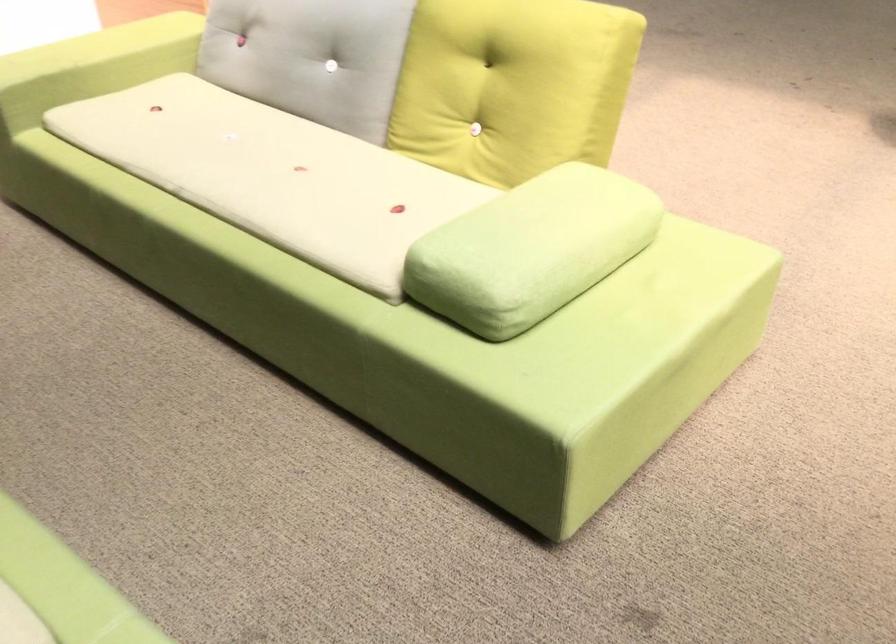
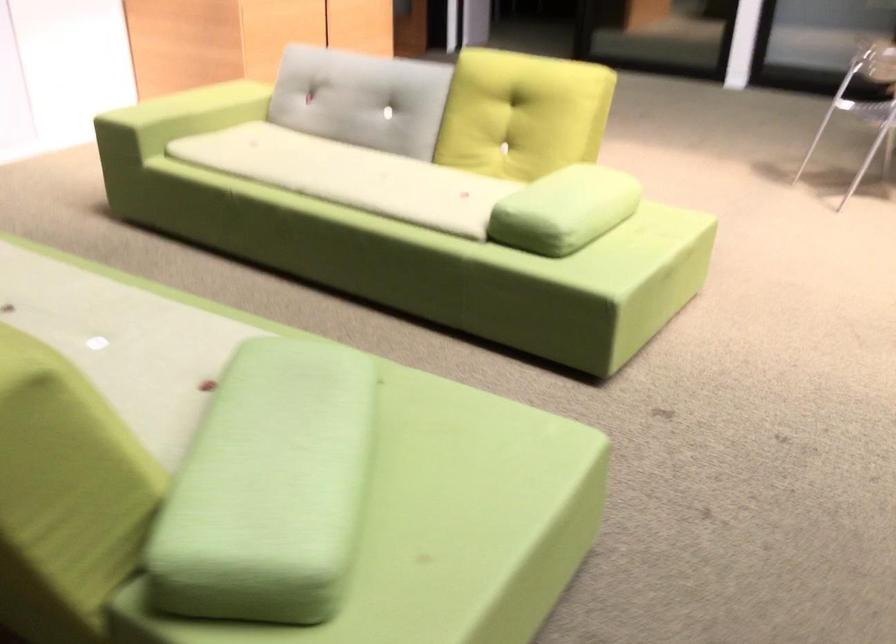
Locate, in the second image, the point that corresponds to point (511, 267) in the first image.

(564, 210)